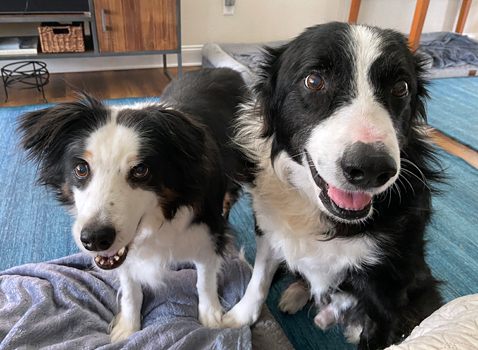
This screenshot has width=478, height=350. Find the location of `white fur`. white fur is located at coordinates (188, 238), (300, 229), (364, 123), (109, 154).